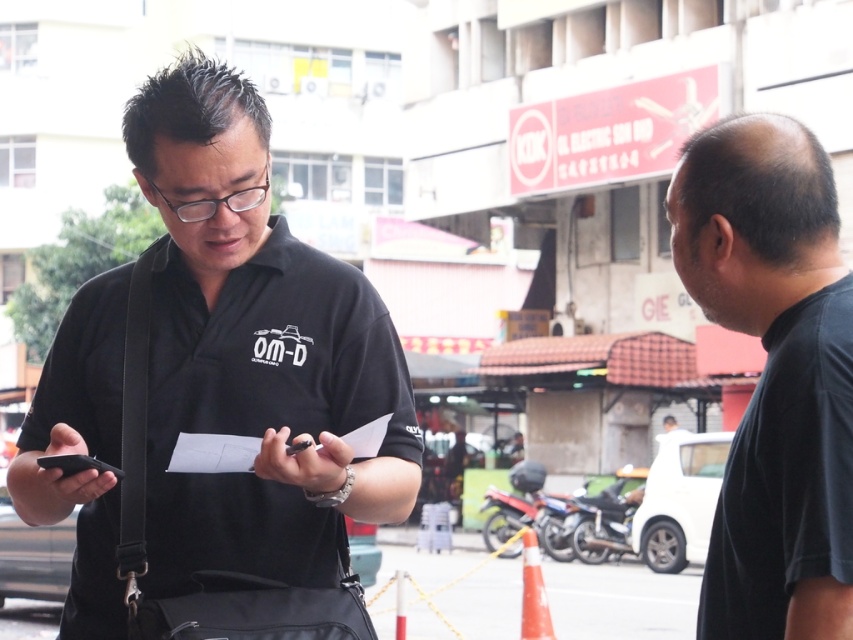
Question: Which object is the closest to the metallic silver motorcycle at lower right?

Choices:
 (A) black matte smartphone at left
 (B) metallic silver motorcycle at center

Answer: (B)

Question: Which point is closer to the camera?

Choices:
 (A) (88, 465)
 (B) (351, 499)
 (C) (488, 525)
 (D) (817, 196)

Answer: (D)

Question: Which point is farther to the camera?

Choices:
 (A) black matte smartphone at left
 (B) black matte shirt at center
 (C) metallic silver motorcycle at lower right
 (D) black matte shirt at right

Answer: (C)

Question: Can you confirm if black matte shirt at center is positioned to the right of black matte smartphone at left?

Choices:
 (A) yes
 (B) no

Answer: (A)

Question: Can you confirm if black matte shirt at right is positioned to the right of metallic silver motorcycle at center?

Choices:
 (A) no
 (B) yes

Answer: (A)

Question: Does metallic silver motorcycle at lower right appear under metallic silver motorcycle at center?

Choices:
 (A) no
 (B) yes

Answer: (A)